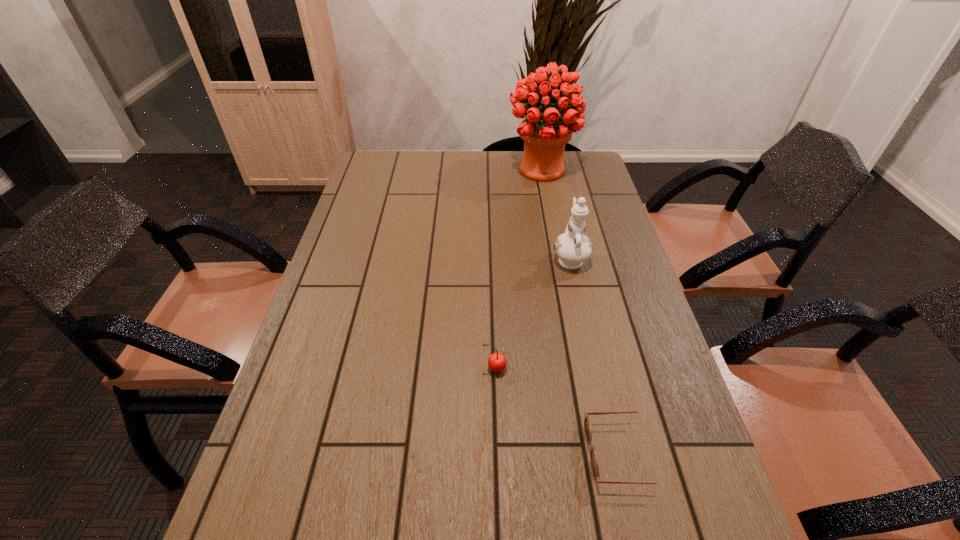
Where is `object located in the far right corner section of the desktop`? The width and height of the screenshot is (960, 540). object located in the far right corner section of the desktop is located at coordinates (545, 132).

In order to click on free space at the far edge in this screenshot , I will do `click(466, 171)`.

In the image, there is a desktop. Identify the location of free space at the left edge. (369, 269).

In the image, there is a desktop. At what (x,y) coordinates should I click in order to perform the action: click on vacant space at the right edge. Please return your answer as a coordinate pair (x, y). Looking at the image, I should click on (669, 424).

What are the coordinates of `free space at the far left corner of the desktop` in the screenshot? It's located at (367, 176).

This screenshot has width=960, height=540. I want to click on free area in between the bouquet and the second nearest object, so click(517, 269).

This screenshot has height=540, width=960. I want to click on vacant region between the sunglasses and the chinaware, so click(597, 356).

Identify the location of vacant area that lies between the bouquet and the third nearest object. The height and width of the screenshot is (540, 960). (556, 214).

Where is `free space between the tallest object and the cherry`? This screenshot has width=960, height=540. free space between the tallest object and the cherry is located at coordinates (x=517, y=269).

Locate an element on the screen. The height and width of the screenshot is (540, 960). free point between the chinaware and the cherry is located at coordinates (532, 313).